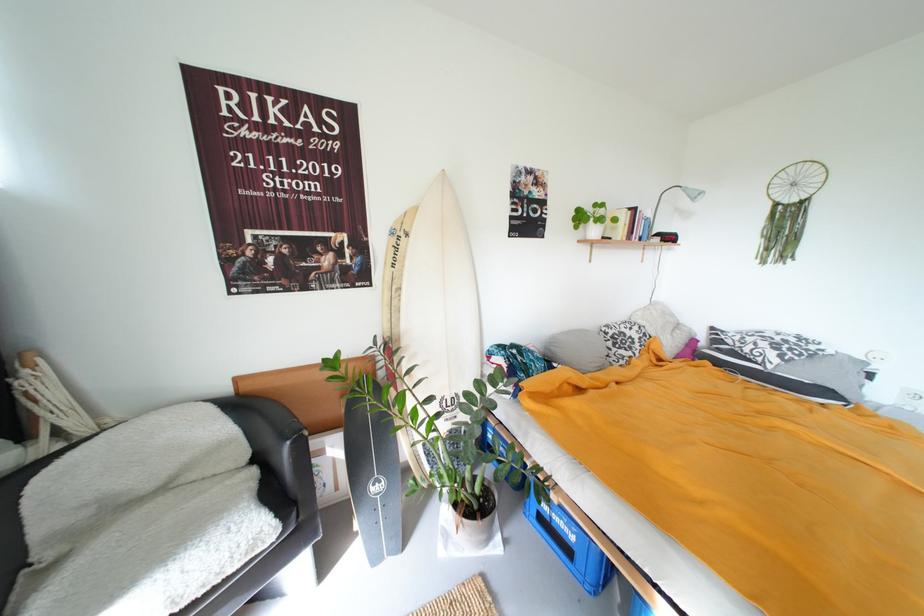
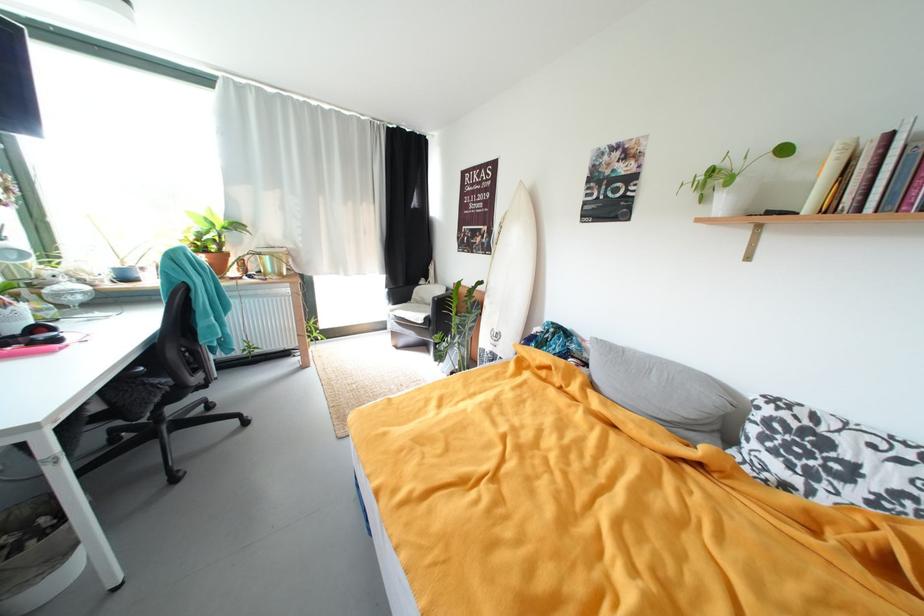
In the second image, find the point that corresponds to [645,347] in the first image.

(861, 493)